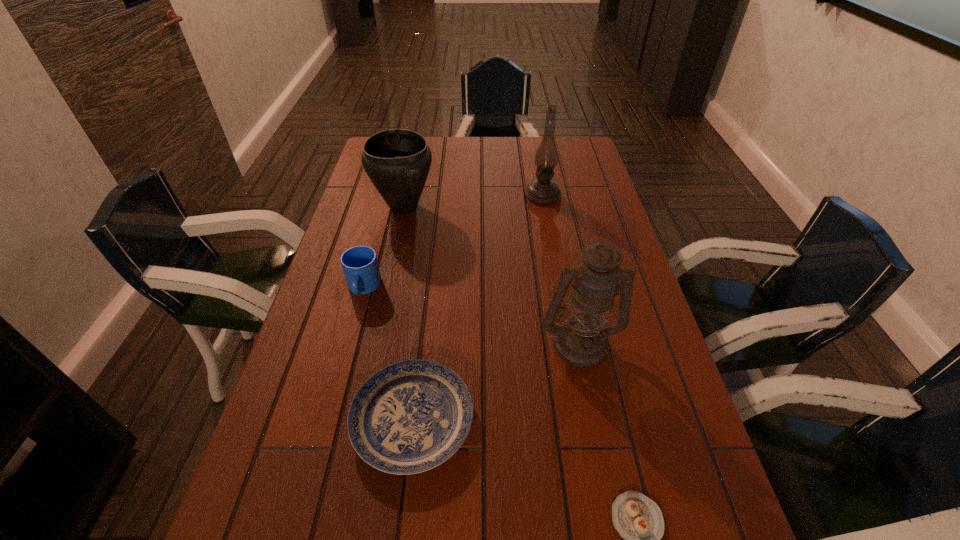
Locate an element on the screen. vacant area situated on the back of the plate is located at coordinates (422, 341).

I want to click on urn at the left edge, so click(x=397, y=161).

Find the location of `mug that is at the left edge`. mug that is at the left edge is located at coordinates (360, 265).

Where is `plate that is at the left edge`? The height and width of the screenshot is (540, 960). plate that is at the left edge is located at coordinates (411, 416).

The image size is (960, 540). Identify the location of blank area at the left edge. (363, 170).

Locate an element on the screen. The height and width of the screenshot is (540, 960). vacant region at the right edge of the desktop is located at coordinates (609, 230).

What are the coordinates of `free point between the nearer oil lamp and the plate` in the screenshot? It's located at (496, 381).

Find the location of a particular element. The image size is (960, 540). free space between the fourth farthest object and the fourth shortest object is located at coordinates (492, 275).

You are a GUI agent. You are given a task and a screenshot of the screen. Output one action in this format:
    pyautogui.click(x=<x>, y=<y>)
    Task: Click on the free space between the farther oil lamp and the fourth shortest object
    
    Given the screenshot: What is the action you would take?
    tap(473, 201)

The height and width of the screenshot is (540, 960). What are the coordinates of `free spot between the fourth shortest object and the nearer oil lamp` in the screenshot? It's located at pos(492,275).